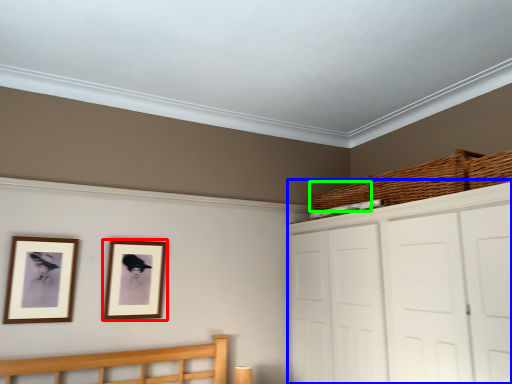
Question: Which is farther away from picture frame (highlighted by a red box)? dresser (highlighted by a blue box) or basket (highlighted by a green box)?

Choices:
 (A) dresser
 (B) basket

Answer: (B)